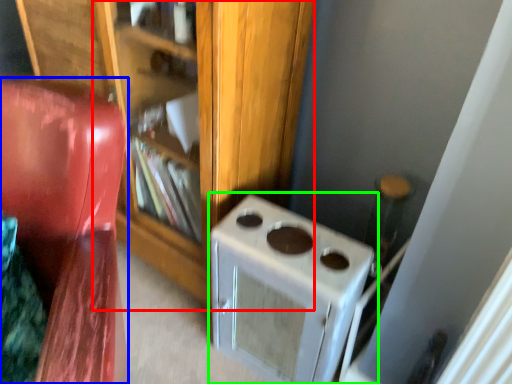
Question: Considering the real-world distances, which object is farthest from bookshelf (highlighted by a red box)? furniture (highlighted by a blue box) or home appliance (highlighted by a green box)?

Choices:
 (A) furniture
 (B) home appliance

Answer: (A)